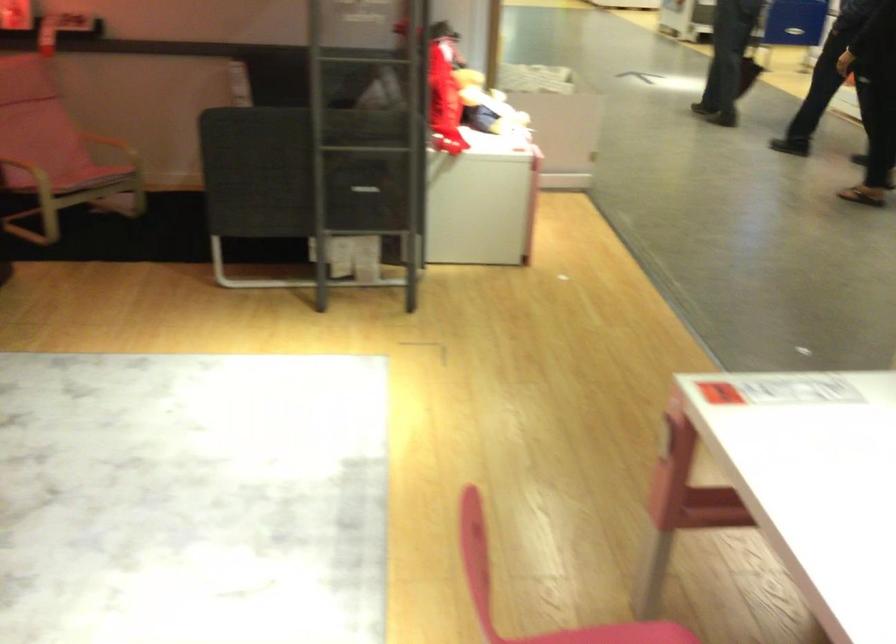
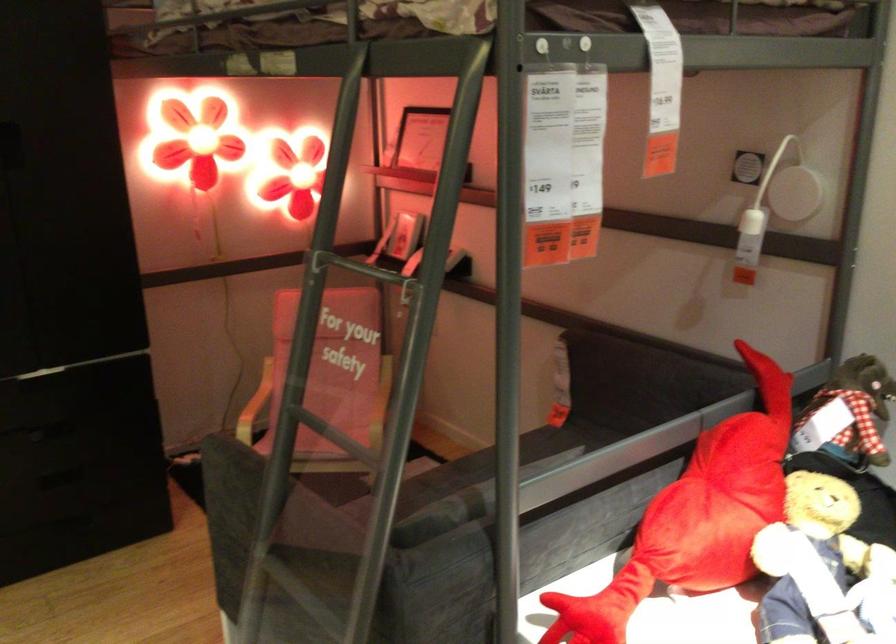
The point at [505,99] is marked in the first image. Where is the corresponding point in the second image?

(823, 569)